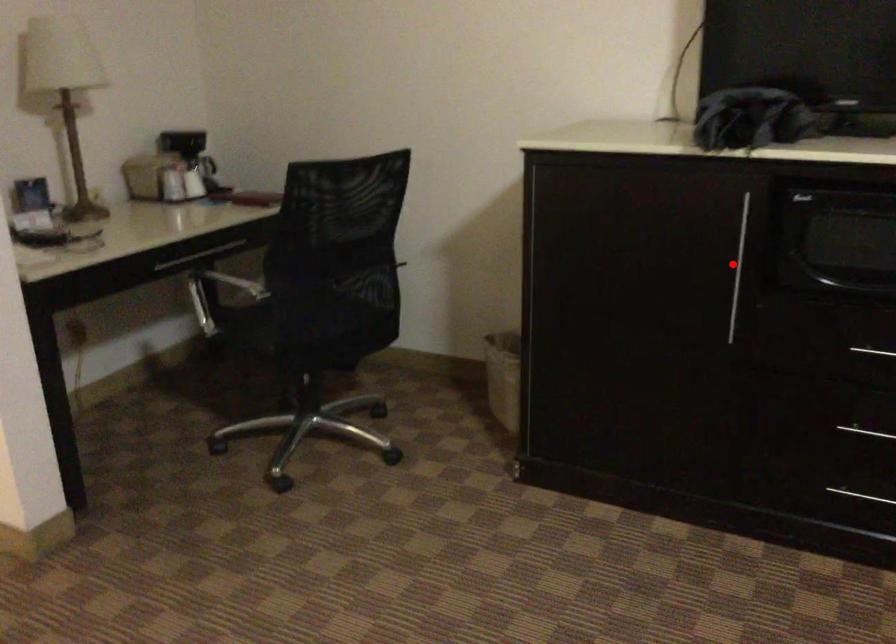
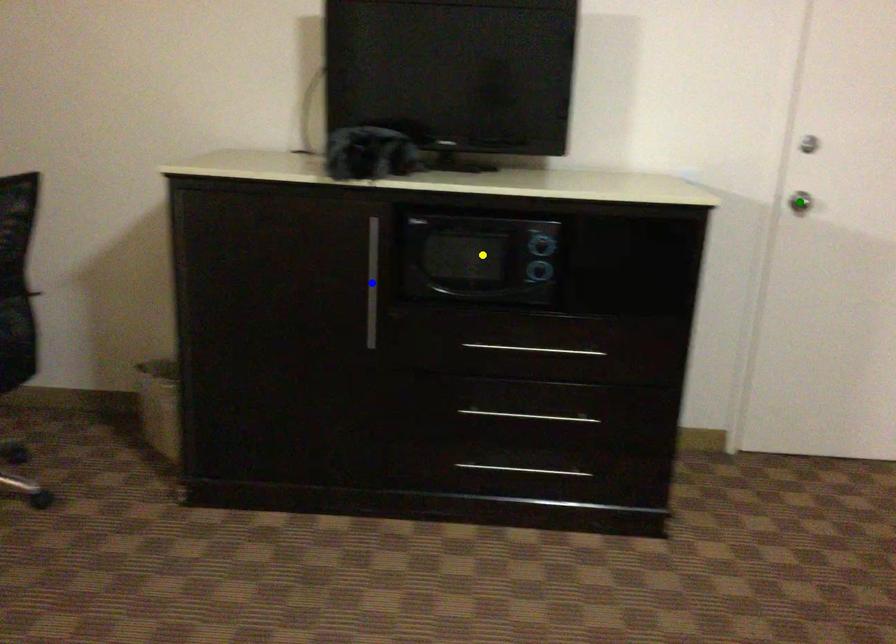
Question: I am providing you with two images of the same scene from different viewpoints. A red point is marked on the first image. You are given multiple points on the second image. Which point in image 2 is actually the same real-world point as the red point in image 1?

Choices:
 (A) yellow point
 (B) blue point
 (C) green point

Answer: (B)